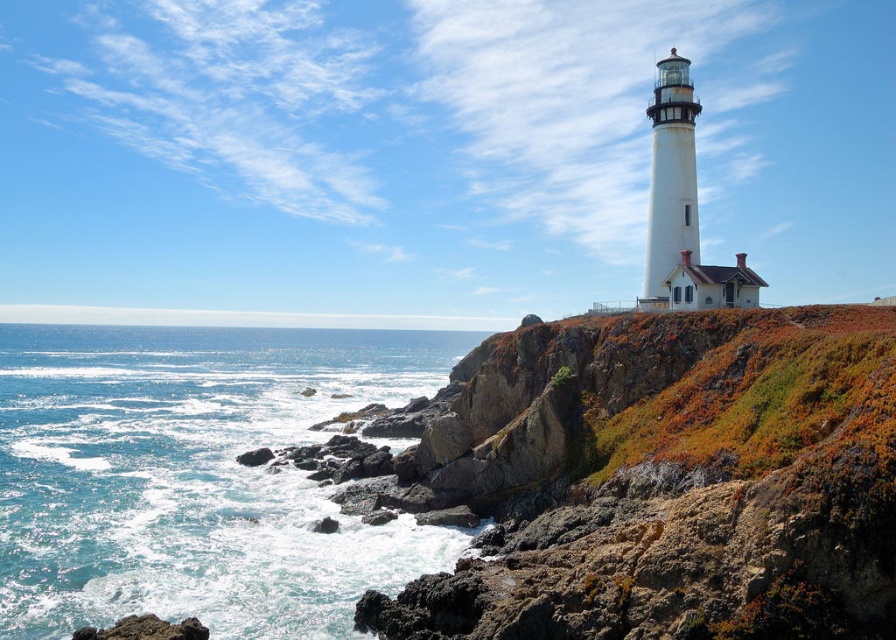
Does blue water at lower left have a lesser height compared to rough textured rock at lower left?

No.

Is blue water at lower left wider than rough textured rock at lower left?

Indeed, blue water at lower left has a greater width compared to rough textured rock at lower left.

Who is more distant from viewer, (22, 620) or (190, 627)?

Positioned behind is point (22, 620).

Where is `blue water at lower left`? The width and height of the screenshot is (896, 640). blue water at lower left is located at coordinates (196, 476).